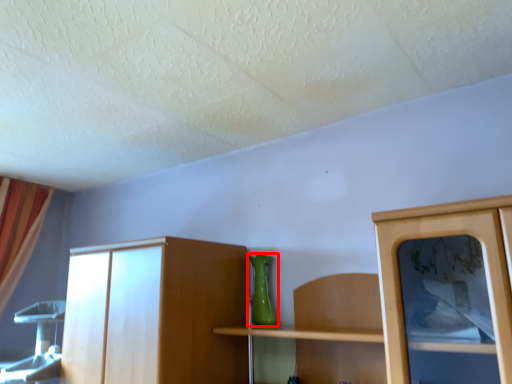
Question: Considering the relative positions of vase (annotated by the red box) and curtain in the image provided, where is vase (annotated by the red box) located with respect to the staircase?

Choices:
 (A) right
 (B) left

Answer: (A)